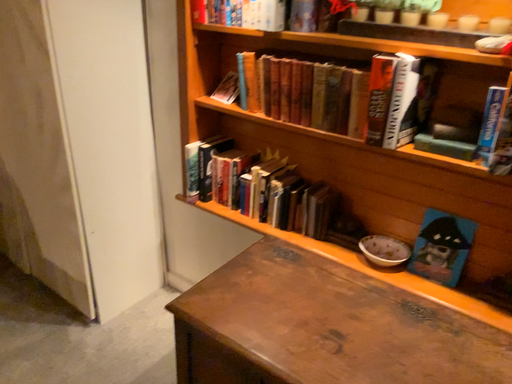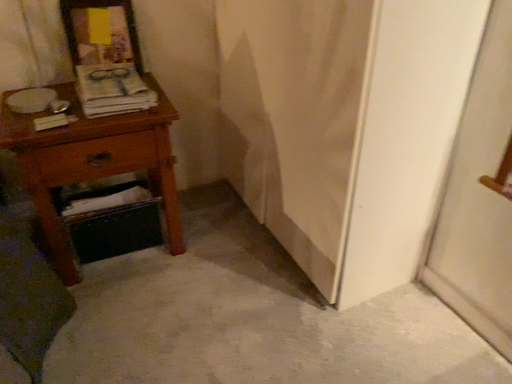
Question: How did the camera likely rotate when shooting the video?

Choices:
 (A) rotated right
 (B) rotated left

Answer: (B)